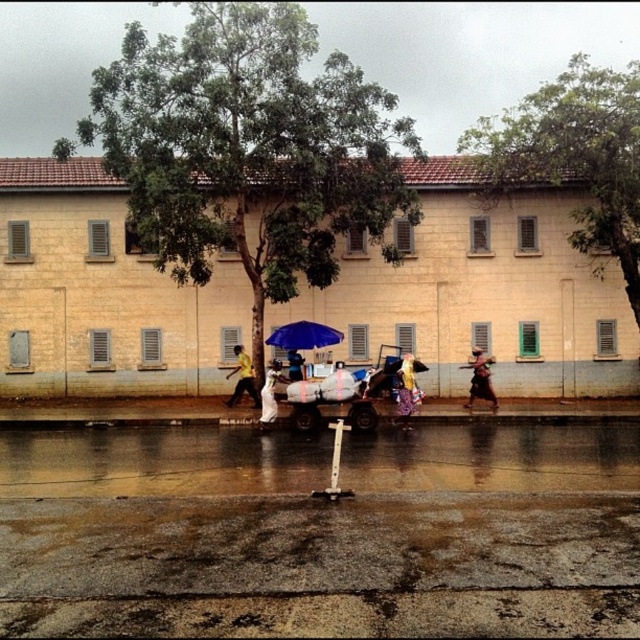
Does matte black umbrella at center come behind yellow matte shirt at center?

No, it is not.

Can you confirm if matte black umbrella at center is wider than yellow matte shirt at center?

Incorrect, matte black umbrella at center's width does not surpass yellow matte shirt at center's.

Who is more forward, (481, 387) or (250, 381)?

Point (481, 387)

This screenshot has width=640, height=640. Identify the location of matte black umbrella at center. [x=481, y=380].

Is white matte dress at center shorter than matte yellow shirt at center?

In fact, white matte dress at center may be taller than matte yellow shirt at center.

Locate an element on the screen. The width and height of the screenshot is (640, 640). white matte dress at center is located at coordinates (269, 392).

Looking at this image, does blue matte umbrella at center appear over matte yellow shirt at center?

Indeed, blue matte umbrella at center is positioned over matte yellow shirt at center.

Find the location of a particular element. The height and width of the screenshot is (640, 640). blue matte umbrella at center is located at coordinates (x=304, y=337).

Image resolution: width=640 pixels, height=640 pixels. Identify the location of blue matte umbrella at center. (304, 337).